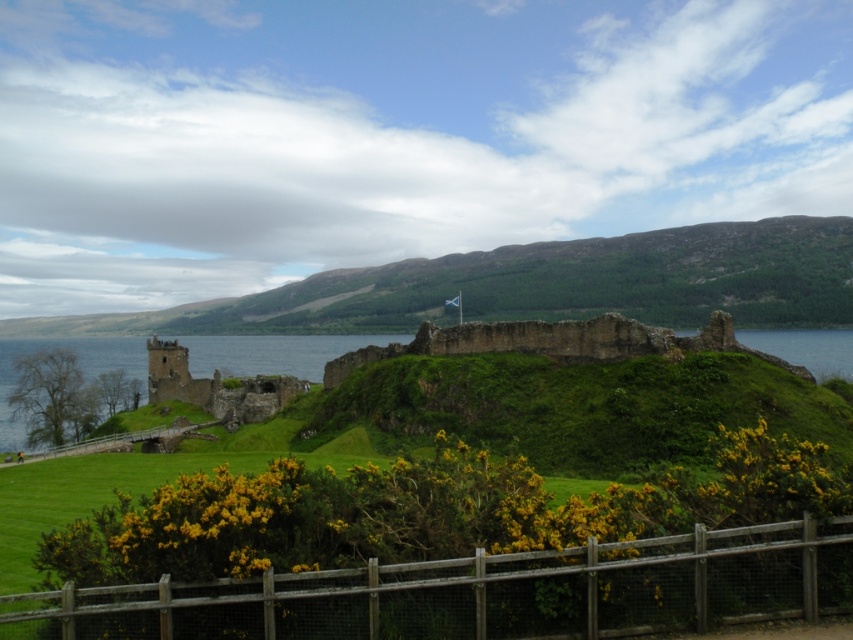
Which is behind, point (288, 630) or point (471, 275)?

Point (471, 275)

Measure the distance between point (527,625) and camera.

Point (527,625) and camera are 50.41 meters apart.

Locate an element on the screen. The width and height of the screenshot is (853, 640). wooden fence at lower center is located at coordinates (482, 593).

Does green grassy hillside at center have a lesser height compared to green grassy at center?

No.

Which is behind, point (712, 289) or point (340, 445)?

Positioned behind is point (712, 289).

Locate an element on the screen. The width and height of the screenshot is (853, 640). green grassy hillside at center is located at coordinates (543, 285).

Locate an element on the screen. The image size is (853, 640). green grassy hillside at center is located at coordinates (543, 285).

Does wooden fence at lower center have a lesser height compared to brown stone ruins at center?

Yes, wooden fence at lower center is shorter than brown stone ruins at center.

In the scene shown: Can you confirm if wooden fence at lower center is positioned below brown stone ruins at center?

Yes.

Between point (465, 596) and point (163, 371), which one is positioned behind?

Positioned behind is point (163, 371).

You are a GUI agent. You are given a task and a screenshot of the screen. Output one action in this format:
    pyautogui.click(x=<x>, y=<y>)
    Task: Click on the wooden fence at lower center
    
    Given the screenshot: What is the action you would take?
    pyautogui.click(x=482, y=593)